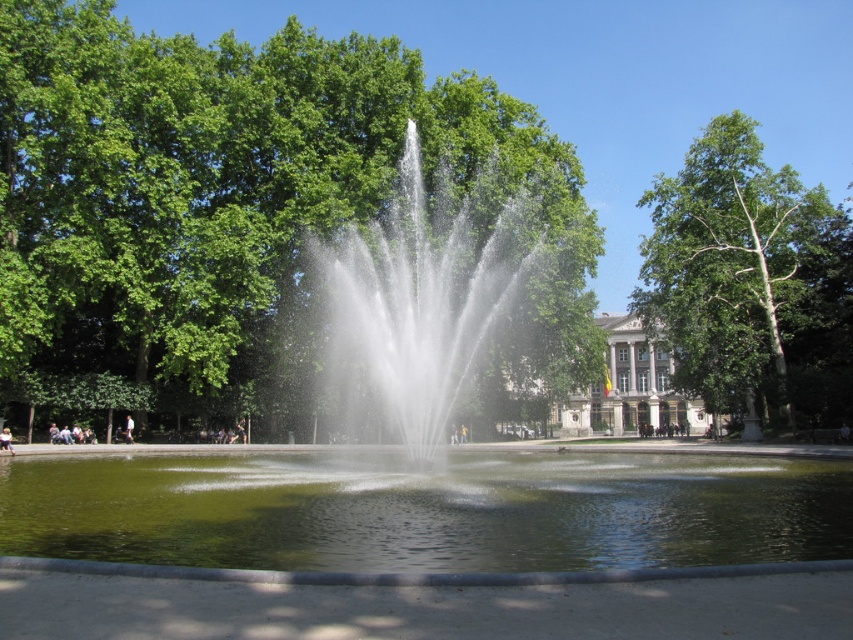
Question: Does clear water fountain at center have a lesser width compared to light blue denim shorts at center?

Choices:
 (A) no
 (B) yes

Answer: (A)

Question: Can you confirm if green leafy tree at center is positioned to the right of clear water fountain at center?

Choices:
 (A) yes
 (B) no

Answer: (B)

Question: Among these objects, which one is nearest to the camera?

Choices:
 (A) green liquid water at center
 (B) green leafy tree at right
 (C) clear water fountain at center
 (D) light blue denim shorts at center

Answer: (C)

Question: Based on their relative distances, which object is farther from the green leafy tree at center?

Choices:
 (A) green leafy tree at right
 (B) clear water fountain at center

Answer: (A)

Question: Which point is closer to the camera?

Choices:
 (A) (4, 440)
 (B) (743, 518)

Answer: (B)

Question: Can you confirm if green liquid water at center is wider than green leafy tree at right?

Choices:
 (A) no
 (B) yes

Answer: (B)